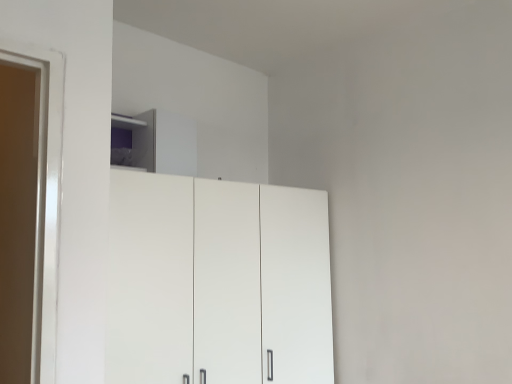
Question: Is white matte cupboard at center taller than white glossy cabinet at upper center?

Choices:
 (A) yes
 (B) no

Answer: (A)

Question: Is white matte cupboard at center positioned with its back to white glossy cabinet at upper center?

Choices:
 (A) no
 (B) yes

Answer: (A)

Question: Can you confirm if white matte cupboard at center is positioned to the left of white glossy cabinet at upper center?

Choices:
 (A) no
 (B) yes

Answer: (A)

Question: From the image's perspective, would you say white matte cupboard at center is positioned over white glossy cabinet at upper center?

Choices:
 (A) yes
 (B) no

Answer: (B)

Question: Does white matte cupboard at center have a lesser height compared to white glossy cabinet at upper center?

Choices:
 (A) no
 (B) yes

Answer: (A)

Question: Can you confirm if white matte cupboard at center is positioned to the right of white glossy cabinet at upper center?

Choices:
 (A) yes
 (B) no

Answer: (A)

Question: Can you confirm if white glossy cabinet at upper center is shorter than white matte cupboard at center?

Choices:
 (A) yes
 (B) no

Answer: (A)

Question: Would you consider white glossy cabinet at upper center to be distant from white matte cupboard at center?

Choices:
 (A) no
 (B) yes

Answer: (A)

Question: Are white glossy cabinet at upper center and white matte cupboard at center beside each other?

Choices:
 (A) yes
 (B) no

Answer: (B)

Question: Does white glossy cabinet at upper center have a greater height compared to white matte cupboard at center?

Choices:
 (A) yes
 (B) no

Answer: (B)

Question: Is the depth of white glossy cabinet at upper center greater than that of white matte cupboard at center?

Choices:
 (A) yes
 (B) no

Answer: (A)

Question: From the image's perspective, would you say white glossy cabinet at upper center is shown under white matte cupboard at center?

Choices:
 (A) yes
 (B) no

Answer: (B)

Question: From the image's perspective, is white glossy cabinet at upper center positioned above or below white matte cupboard at center?

Choices:
 (A) above
 (B) below

Answer: (A)